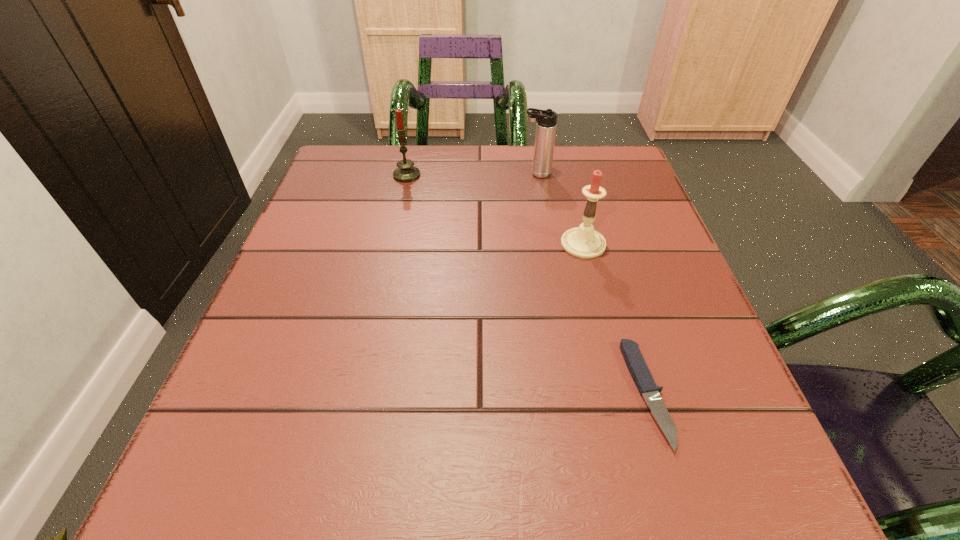
You are a GUI agent. You are given a task and a screenshot of the screen. Output one action in this format:
    pyautogui.click(x=<x>, y=<y>)
    Task: Click on the free space located on the handle side of the thermos bottle
    
    Given the screenshot: What is the action you would take?
    pyautogui.click(x=399, y=174)

Image resolution: width=960 pixels, height=540 pixels. I want to click on free region located on the handle side of the thermos bottle, so click(448, 174).

Find the location of a particular element. This screenshot has width=960, height=540. vacant space located 0.100m on the left of the shortest object is located at coordinates (564, 393).

What are the coordinates of `candle that is at the far edge` in the screenshot? It's located at [x=406, y=172].

Locate an element on the screen. Image resolution: width=960 pixels, height=540 pixels. thermos bottle that is at the far edge is located at coordinates pos(546,125).

You are a GUI agent. You are given a task and a screenshot of the screen. Output one action in this format:
    pyautogui.click(x=<x>, y=<y>)
    Task: Click on the object that is at the near edge
    The height and width of the screenshot is (540, 960).
    Given the screenshot: What is the action you would take?
    coord(635,362)

Locate an element on the screen. The image size is (960, 540). candle present at the right edge is located at coordinates (583, 242).

This screenshot has width=960, height=540. Find the location of `steak knife situated at the right edge`. steak knife situated at the right edge is located at coordinates (635, 362).

The height and width of the screenshot is (540, 960). What are the coordinates of `object that is positioned at the near right corner` in the screenshot? It's located at (635, 362).

What are the coordinates of `free region at the far edge of the desktop` in the screenshot? It's located at (424, 192).